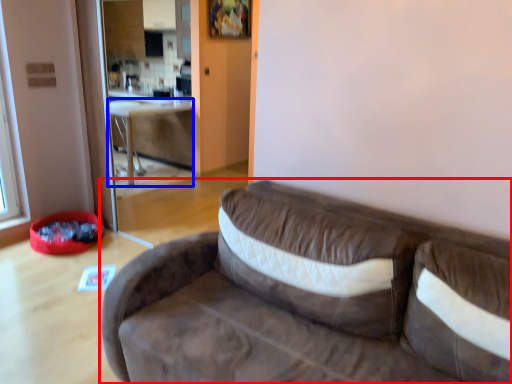
Question: Which of the following is the closest to the observer, studio couch (highlighted by a red box) or table (highlighted by a blue box)?

Choices:
 (A) studio couch
 (B) table

Answer: (A)